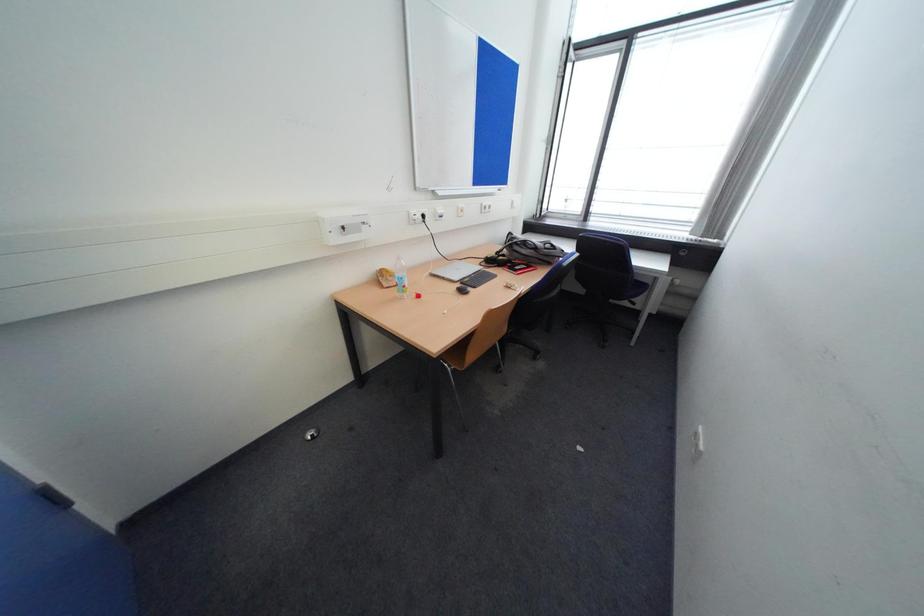
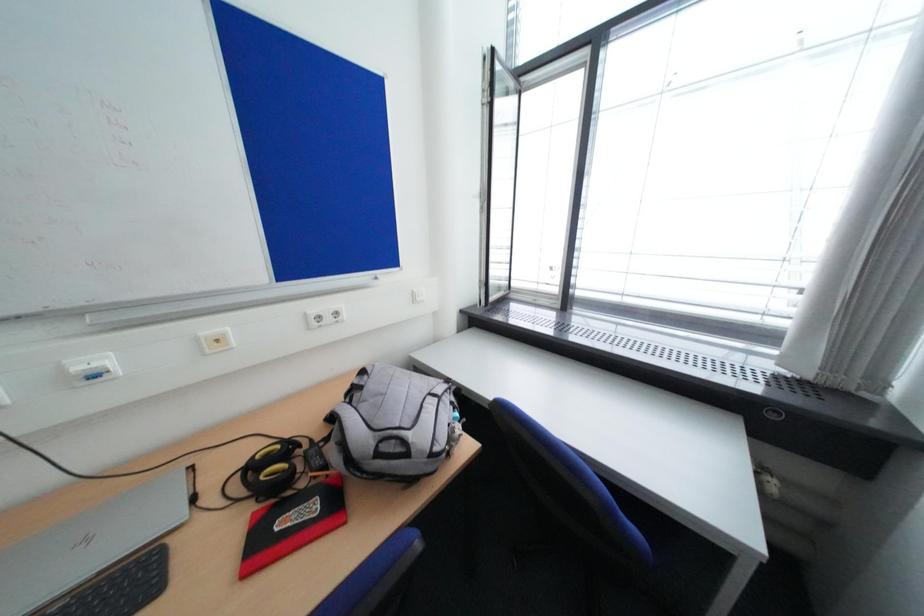
The images are taken continuously from a first-person perspective. In which direction are you moving?

The cameraman moved toward right, forward.